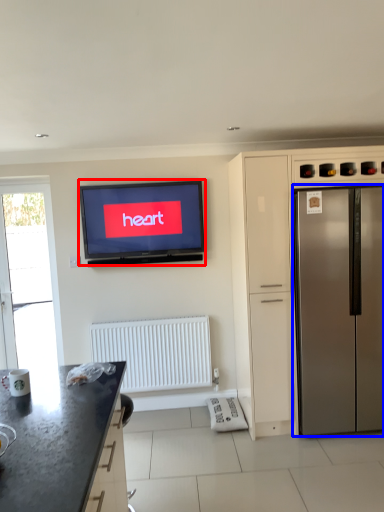
Question: Which object appears farthest to the camera in this image, television (highlighted by a red box) or refrigerator (highlighted by a blue box)?

Choices:
 (A) television
 (B) refrigerator

Answer: (A)